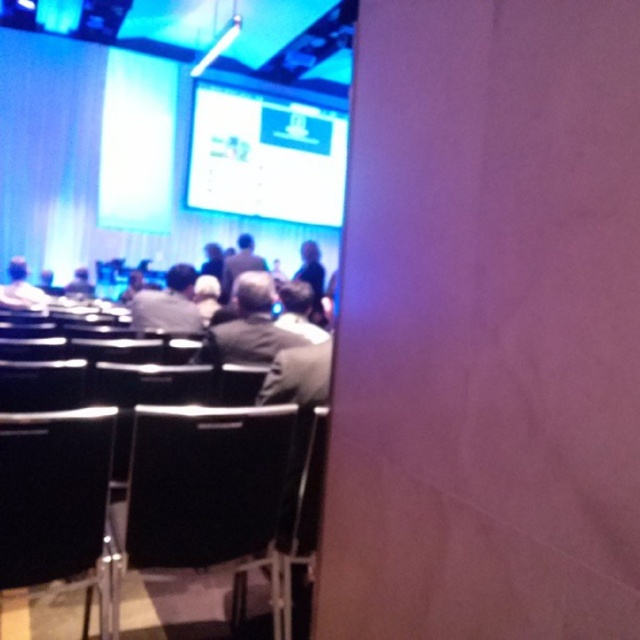
Question: Among these objects, which one is nearest to the camera?

Choices:
 (A) black leather chair at center
 (B) black plastic chair at lower left
 (C) gray fabric jacket at center
 (D) gray fabric jacket at left

Answer: (B)

Question: Which of the following is the farthest from the observer?

Choices:
 (A) (22, 276)
 (B) (256, 413)
 (C) (266, 268)

Answer: (C)

Question: Can you confirm if black plastic chair at lower left is positioned to the right of gray fabric jacket at center?

Choices:
 (A) no
 (B) yes

Answer: (B)

Question: Is black leather chair at center positioned at the back of matte white screen at upper center?

Choices:
 (A) yes
 (B) no

Answer: (B)

Question: Does black leather chair at center have a larger size compared to dark gray fabric jacket at center?

Choices:
 (A) no
 (B) yes

Answer: (B)

Question: Considering the real-world distances, which object is closest to the gray fabric jacket at left?

Choices:
 (A) black leather chair at center
 (B) matte white screen at upper center
 (C) gray fabric jacket at center

Answer: (C)